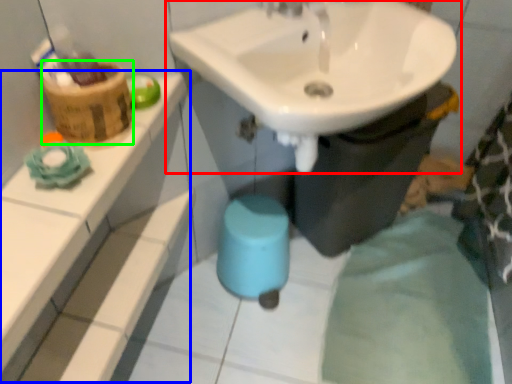
Question: Considering the real-world distances, which object is farthest from sink (highlighted by a red box)? balustrade (highlighted by a blue box) or basket (highlighted by a green box)?

Choices:
 (A) balustrade
 (B) basket

Answer: (A)